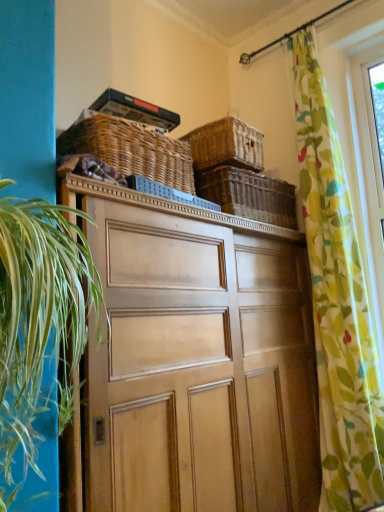
Question: Can you confirm if wooden cabinet at center is positioned to the left of woven brown basket at upper center, which is counted as the 2th basket, starting from the left?

Choices:
 (A) yes
 (B) no

Answer: (A)

Question: From the image's perspective, would you say wooden cabinet at center is shown under woven brown basket at upper center, which is the 2th basket in right-to-left order?

Choices:
 (A) no
 (B) yes

Answer: (B)

Question: Is wooden cabinet at center looking in the opposite direction of woven brown basket at upper center, which is the 2th basket in right-to-left order?

Choices:
 (A) yes
 (B) no

Answer: (B)

Question: Does wooden cabinet at center turn towards woven brown basket at upper center, which is counted as the 2th basket, starting from the left?

Choices:
 (A) yes
 (B) no

Answer: (B)

Question: Is wooden cabinet at center thinner than woven brown basket at upper center, which is counted as the 2th basket, starting from the left?

Choices:
 (A) no
 (B) yes

Answer: (A)

Question: Based on their sizes in the image, would you say woven brown basket at upper center, which is counted as the 2th basket, starting from the left, is bigger or smaller than woven wicker basket at upper center, the 1th basket when ordered from right to left?

Choices:
 (A) small
 (B) big

Answer: (A)

Question: Is point (233, 120) closer or farther from the camera than point (193, 174)?

Choices:
 (A) farther
 (B) closer

Answer: (B)

Question: From the image's perspective, is woven brown basket at upper center, which is counted as the 2th basket, starting from the left, above or below woven wicker basket at upper center, the third basket when ordered from left to right?

Choices:
 (A) below
 (B) above

Answer: (B)

Question: From a real-world perspective, is woven brown basket at upper center, which is the 2th basket in right-to-left order, physically located above or below woven wicker basket at upper center, the 1th basket when ordered from right to left?

Choices:
 (A) above
 (B) below

Answer: (A)

Question: Is woven brown basket at upper center, positioned as the first basket in left-to-right order, in front of or behind green leafy plant at left in the image?

Choices:
 (A) front
 (B) behind

Answer: (B)

Question: In terms of size, does woven brown basket at upper center, marked as the third basket in a right-to-left arrangement, appear bigger or smaller than green leafy plant at left?

Choices:
 (A) big
 (B) small

Answer: (B)

Question: Which is correct: woven brown basket at upper center, positioned as the first basket in left-to-right order, is inside green leafy plant at left, or outside of it?

Choices:
 (A) outside
 (B) inside

Answer: (A)

Question: From a real-world perspective, is woven brown basket at upper center, marked as the third basket in a right-to-left arrangement, physically located above or below green leafy plant at left?

Choices:
 (A) below
 (B) above

Answer: (B)

Question: Looking at their shapes, would you say green leafy plant at left is wider or thinner than woven wicker basket at upper center, the third basket when ordered from left to right?

Choices:
 (A) thin
 (B) wide

Answer: (A)

Question: Considering the positions of green leafy plant at left and woven wicker basket at upper center, the 1th basket when ordered from right to left, in the image, is green leafy plant at left bigger or smaller than woven wicker basket at upper center, the 1th basket when ordered from right to left,?

Choices:
 (A) big
 (B) small

Answer: (A)